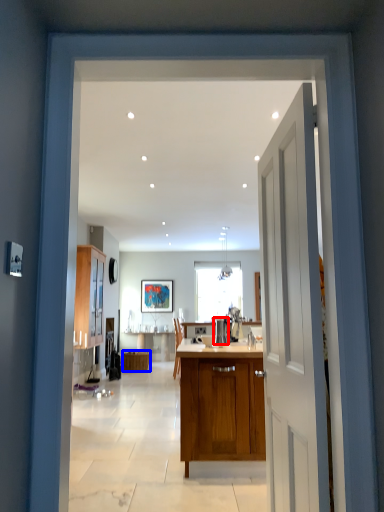
Question: Which object is closer to the camera taking this photo, appliance (highlighted by a red box) or cabinetry (highlighted by a blue box)?

Choices:
 (A) appliance
 (B) cabinetry

Answer: (A)